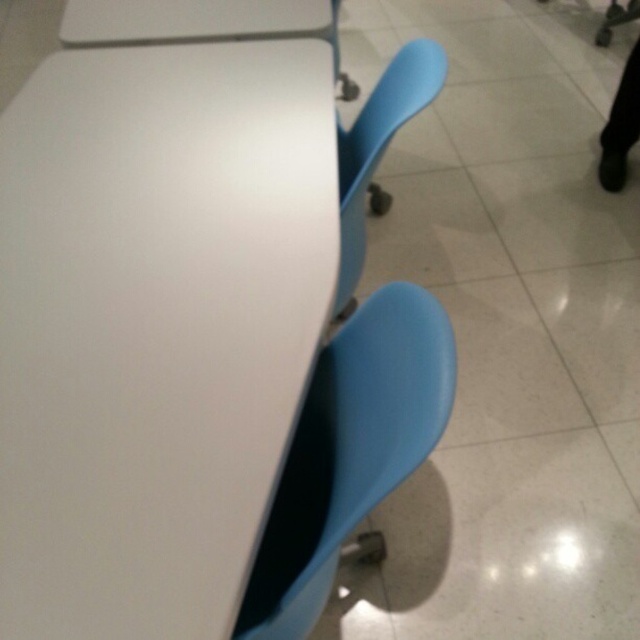
You are standing in the middle of the room and see the point marked at coordinates (156, 324). What object is located at that point?

The white glossy table at center is located at the point marked at coordinates (156, 324).

You are a delivery person bringing a package to the white glossy table at center and the matte blue swivel chair at lower right. The package is too big to carry while moving around both objects. Which object should you place the package on first to ensure you can reach both without needing to move the package again?

The white glossy table at center has a larger size compared to the matte blue swivel chair at lower right. Therefore, you should place the package on the white glossy table at center first, as its larger surface will provide more space to maneuver around both objects without needing to move the package again.